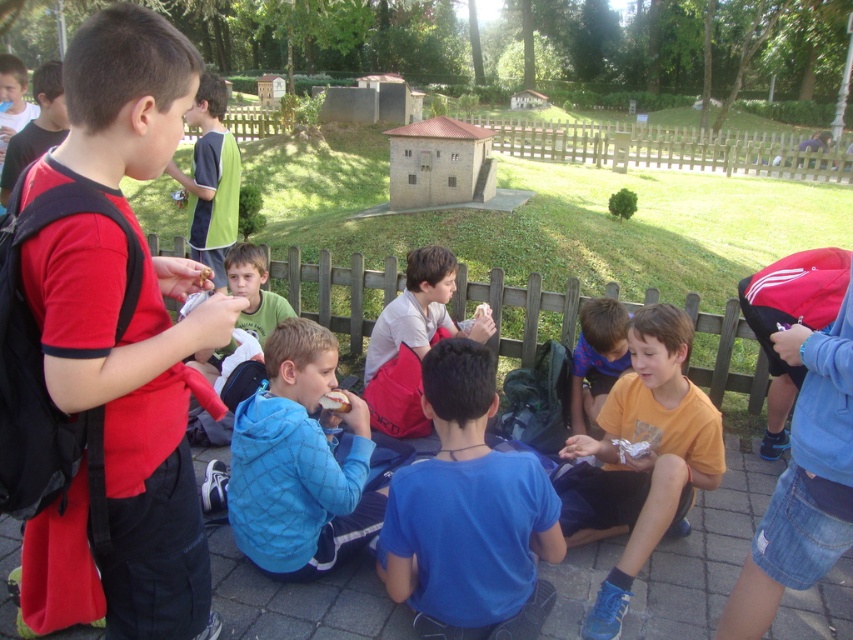
Is blue quilted jacket at center bigger than matte red backpack at left?

Actually, blue quilted jacket at center might be smaller than matte red backpack at left.

Who is higher up, blue quilted jacket at center or matte red backpack at left?

Positioned higher is matte red backpack at left.

At what (x,y) coordinates should I click in order to perform the action: click on blue quilted jacket at center. Please return your answer as a coordinate pair (x, y). Looking at the image, I should click on (305, 461).

Is red matte shirt at left to the left of matte red backpack at left from the viewer's perspective?

In fact, red matte shirt at left is to the right of matte red backpack at left.

Can you confirm if red matte shirt at left is taller than matte red backpack at left?

No, red matte shirt at left is not taller than matte red backpack at left.

You are a GUI agent. You are given a task and a screenshot of the screen. Output one action in this format:
    pyautogui.click(x=<x>, y=<y>)
    Task: Click on the red matte shirt at left
    
    Given the screenshot: What is the action you would take?
    pyautogui.click(x=120, y=346)

Locate an element on the screen. red matte shirt at left is located at coordinates point(120,346).

Does orange cotton shirt at center appear over striped shirt at center?

No.

Is point (651, 451) farther from camera compared to point (576, 420)?

That is False.

Is point (610, 390) positioned in front of point (611, 355)?

Yes, it is in front of point (611, 355).

Identify the location of orange cotton shirt at center. The height and width of the screenshot is (640, 853). (641, 460).